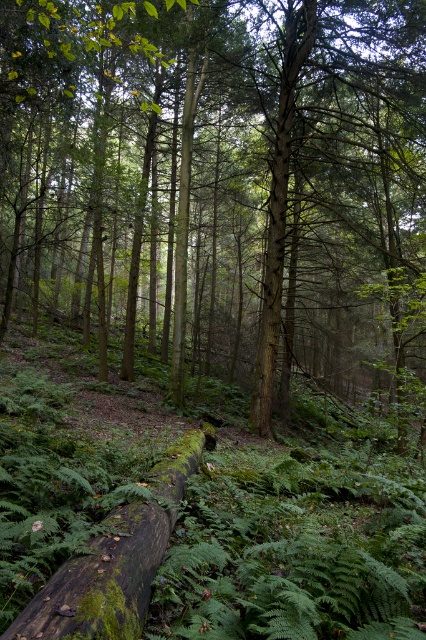
You are a hiker standing at the edge of the forest. You see a green rough bark tree at center and a green mossy log at center. Which object is farther from you?

The green rough bark tree at center is 59.52 feet away from the green mossy log at center, so the green rough bark tree at center is farther away from you than the green mossy log at center.

You are standing in the forest and want to find the green rough bark tree at center. According to the coordinates provided, where should you look relative to the center of the image?

The green rough bark tree at center is located at coordinates point (221, 184), which is slightly to the left and above the center point of the image.

You are a photographer standing in the forest and want to take a picture of the green rough bark tree at center. If your camera can focus on objects up to 3 meters away, will you need to move closer or farther away to get a clear shot?

The green rough bark tree at center is 3.40 meters away from the camera. Since the camera can focus up to 3 meters, you need to move closer to ensure the tree is within the focus range.